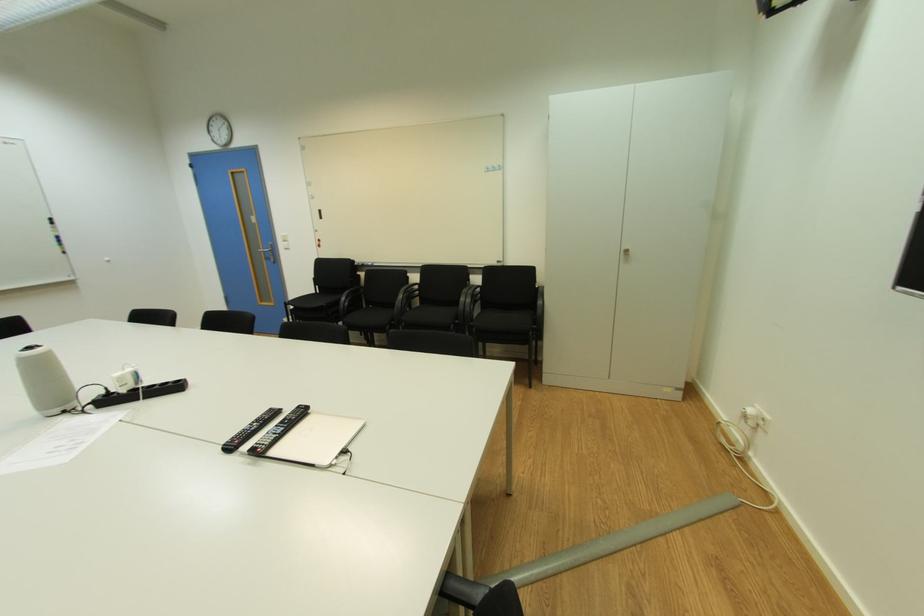
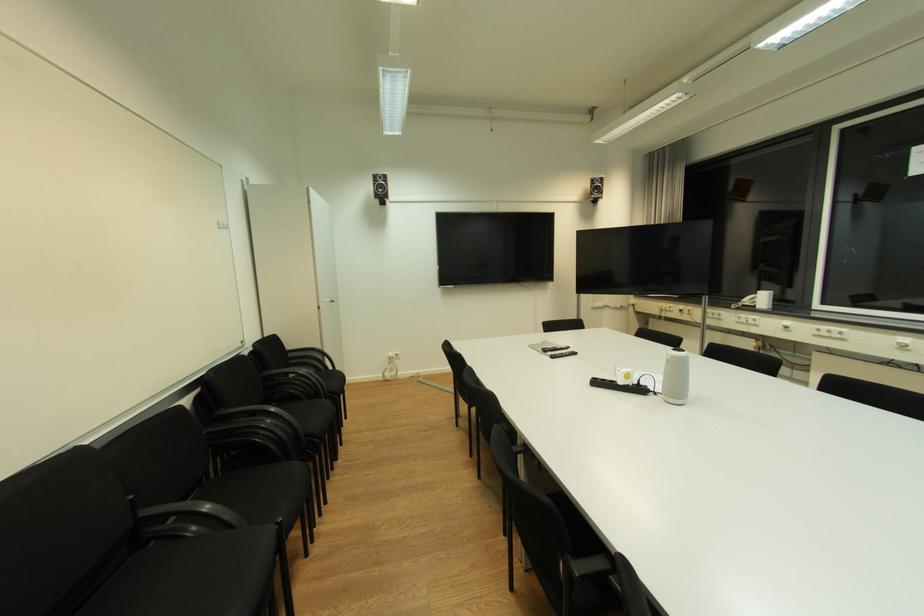
Where in the second image is the point corresponding to point (111, 390) from the first image?

(645, 381)